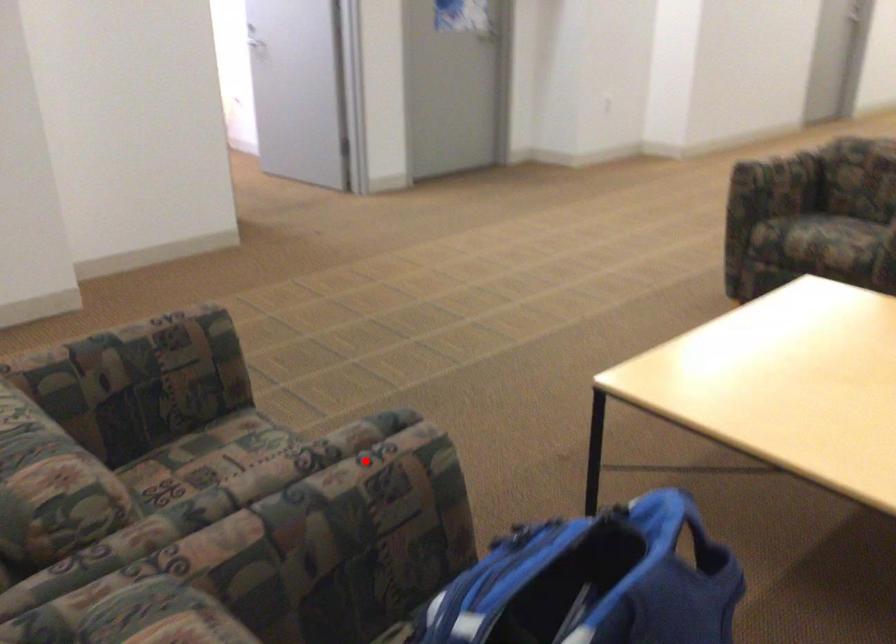
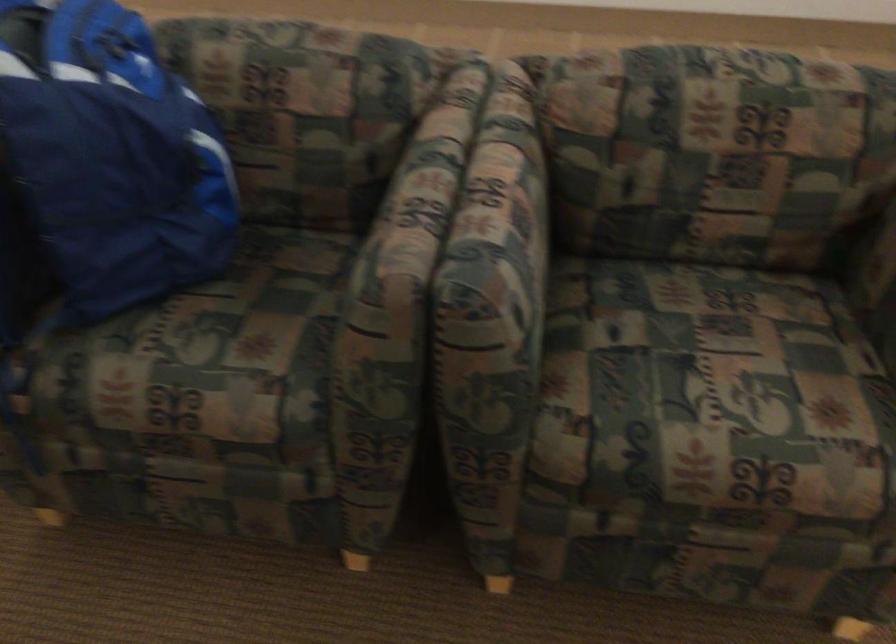
Where in the second image is the point corresponding to the highlighted location from the first image?

(412, 207)